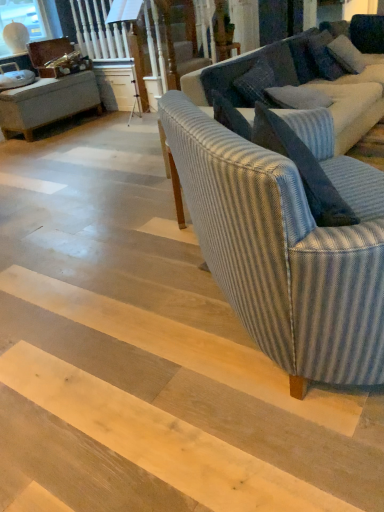
The image size is (384, 512). What are the coordinates of `free space to the left of striped fabric couch at center, which ranks as the second studio couch in back-to-front order` in the screenshot? It's located at pyautogui.click(x=103, y=336).